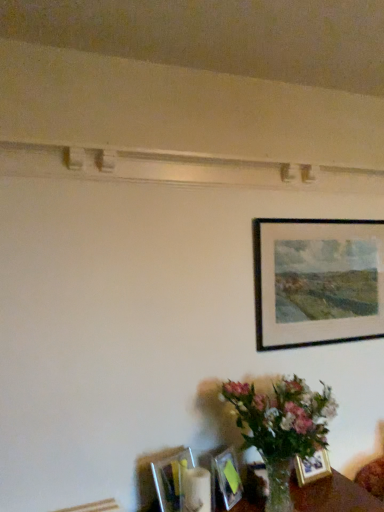
Question: Which direction should I rotate to face metallic silver picture frame at lower center, acting as the 1th picture frame starting from the left, — up or down?

Choices:
 (A) up
 (B) down

Answer: (B)

Question: Which direction should I rotate to face matte glass picture frame at lower center, the second picture frame in the left-to-right sequence, — up or down?

Choices:
 (A) down
 (B) up

Answer: (A)

Question: Is black matte picture frame at upper right, marked as the first picture frame in a top-to-bottom arrangement, looking in the opposite direction of matte glass picture frame at lower center, the second picture frame in the left-to-right sequence?

Choices:
 (A) yes
 (B) no

Answer: (B)

Question: From the image's perspective, is black matte picture frame at upper right, which ranks as the 4th picture frame in bottom-to-top order, below matte glass picture frame at lower center, the 3th picture frame in the top-to-bottom sequence?

Choices:
 (A) yes
 (B) no

Answer: (B)

Question: Are black matte picture frame at upper right, marked as the first picture frame in a top-to-bottom arrangement, and matte glass picture frame at lower center, the second picture frame in the left-to-right sequence, located far from each other?

Choices:
 (A) yes
 (B) no

Answer: (B)

Question: Does black matte picture frame at upper right, which is the 1th picture frame in right-to-left order, have a smaller size compared to matte glass picture frame at lower center, the 3th picture frame in the top-to-bottom sequence?

Choices:
 (A) no
 (B) yes

Answer: (A)

Question: Does black matte picture frame at upper right, marked as the first picture frame in a top-to-bottom arrangement, have a lesser width compared to matte glass picture frame at lower center, the second picture frame in the left-to-right sequence?

Choices:
 (A) yes
 (B) no

Answer: (A)

Question: Is black matte picture frame at upper right, which ranks as the 4th picture frame in bottom-to-top order, to the right of matte glass picture frame at lower center, the 3th picture frame in the top-to-bottom sequence, from the viewer's perspective?

Choices:
 (A) no
 (B) yes

Answer: (B)

Question: Is matte glass picture frame at lower center, which is the third picture frame in right-to-left order, shorter than gold metallic picture frame at lower right, the third picture frame positioned from the left?

Choices:
 (A) no
 (B) yes

Answer: (A)

Question: Is matte glass picture frame at lower center, which ranks as the second picture frame in bottom-to-top order, bigger than gold metallic picture frame at lower right, the 1th picture frame positioned from the bottom?

Choices:
 (A) no
 (B) yes

Answer: (B)

Question: From a real-world perspective, does matte glass picture frame at lower center, the second picture frame in the left-to-right sequence, stand above gold metallic picture frame at lower right, the 1th picture frame positioned from the bottom?

Choices:
 (A) yes
 (B) no

Answer: (A)

Question: Are matte glass picture frame at lower center, the second picture frame in the left-to-right sequence, and gold metallic picture frame at lower right, which is the 4th picture frame in top-to-bottom order, far apart?

Choices:
 (A) no
 (B) yes

Answer: (A)

Question: Can you confirm if matte glass picture frame at lower center, the 3th picture frame in the top-to-bottom sequence, is smaller than gold metallic picture frame at lower right, the 1th picture frame positioned from the bottom?

Choices:
 (A) no
 (B) yes

Answer: (A)

Question: Can you confirm if matte glass picture frame at lower center, the 3th picture frame in the top-to-bottom sequence, is thinner than gold metallic picture frame at lower right, the third picture frame positioned from the left?

Choices:
 (A) no
 (B) yes

Answer: (A)

Question: Can you confirm if matte glass picture frame at lower center, which is the third picture frame in right-to-left order, is wider than black matte picture frame at upper right, which is the 1th picture frame in right-to-left order?

Choices:
 (A) yes
 (B) no

Answer: (A)